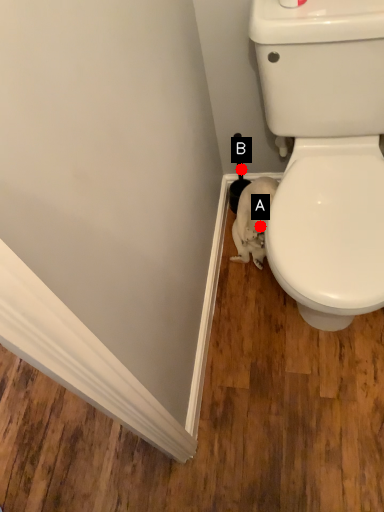
Question: Two points are circled on the image, labeled by A and B beside each circle. Which point is farther from the camera taking this photo?

Choices:
 (A) A is further
 (B) B is further

Answer: (B)